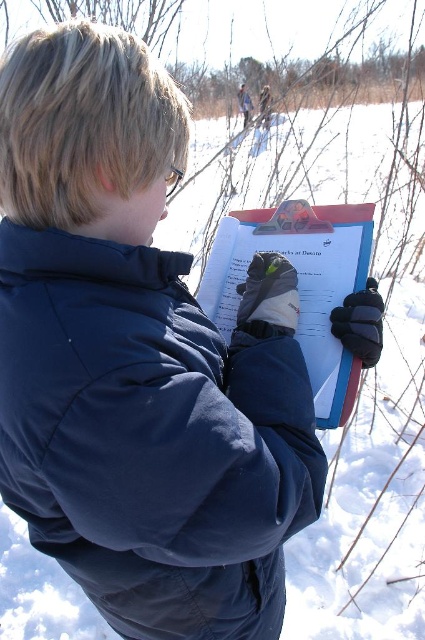
You are a photographer trying to capture a clear shot of the navy blue puffy jacket at center and the matte plastic clipboard at center. Since you want both items to appear in focus, you need to adjust your camera settings. Considering their sizes, which object should you focus on first to ensure proper depth of field?

The navy blue puffy jacket at center is bigger than the matte plastic clipboard at center, so you should focus on the navy blue puffy jacket at center first to ensure both are in focus.

Based on the scene description, what are the coordinates of the navy blue puffy jacket at center?

The navy blue puffy jacket at center is located at coordinates point (x=150, y=436).